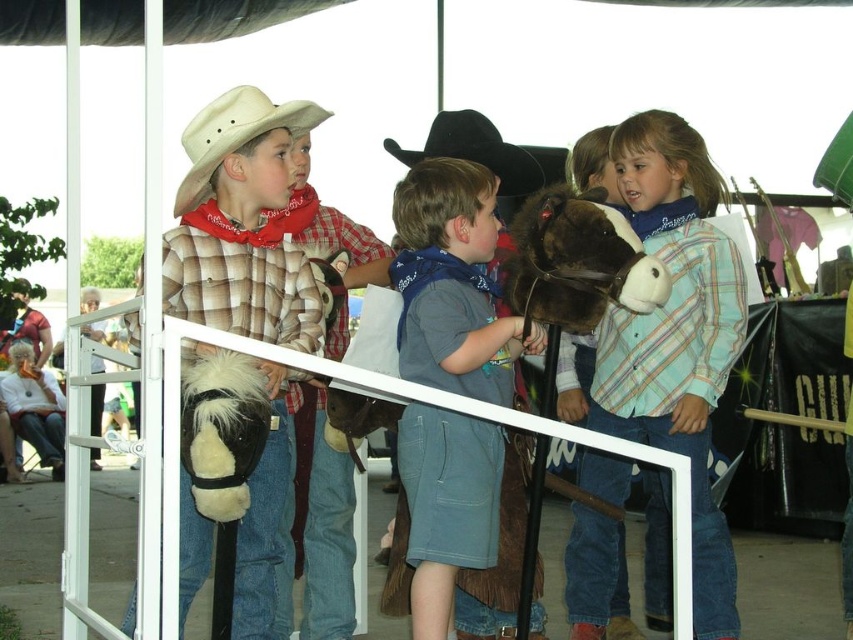
Where is `brown plush horse at center`? This screenshot has width=853, height=640. brown plush horse at center is located at coordinates (577, 262).

How distant is brown plush horse at center from black felt cowboy hat at center?

They are 1.07 meters apart.

Where is `brown plush horse at center`? The width and height of the screenshot is (853, 640). brown plush horse at center is located at coordinates (577, 262).

Locate an element on the screen. brown plush horse at center is located at coordinates (577, 262).

Does plaid shirt at center have a lesser height compared to plaid shirt at left?

No.

Between point (606, 365) and point (193, 579), which one is positioned in front?

Point (193, 579)

Who is more forward, (717, 332) or (131, 634)?

Point (131, 634) is more forward.

Where is `plaid shirt at center`? plaid shirt at center is located at coordinates (676, 337).

Which of these two, plaid shirt at left or blue denim shorts at center, stands taller?

With more height is plaid shirt at left.

At what (x,y) coordinates should I click in order to perform the action: click on plaid shirt at left. Please return your answer as a coordinate pair (x, y). The height and width of the screenshot is (640, 853). Looking at the image, I should click on (241, 225).